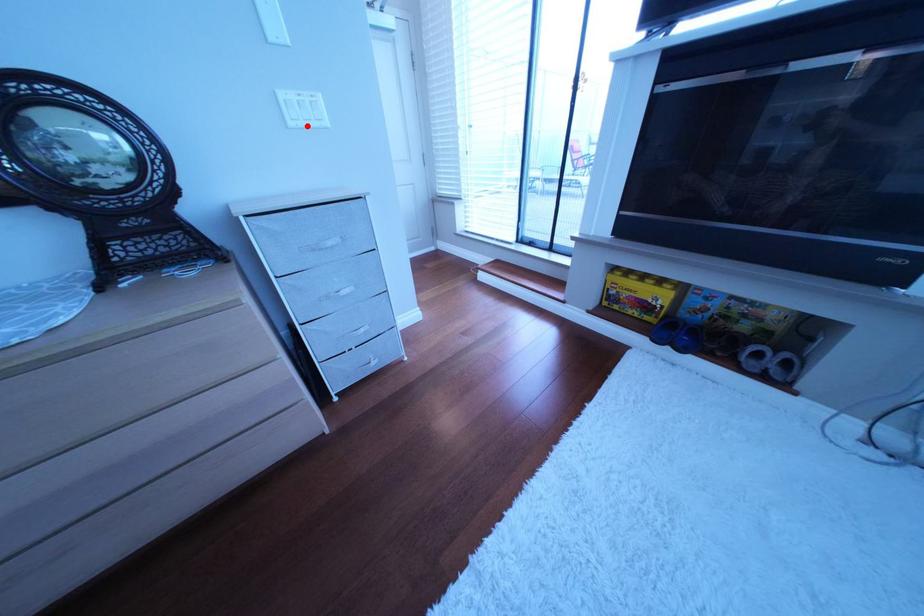
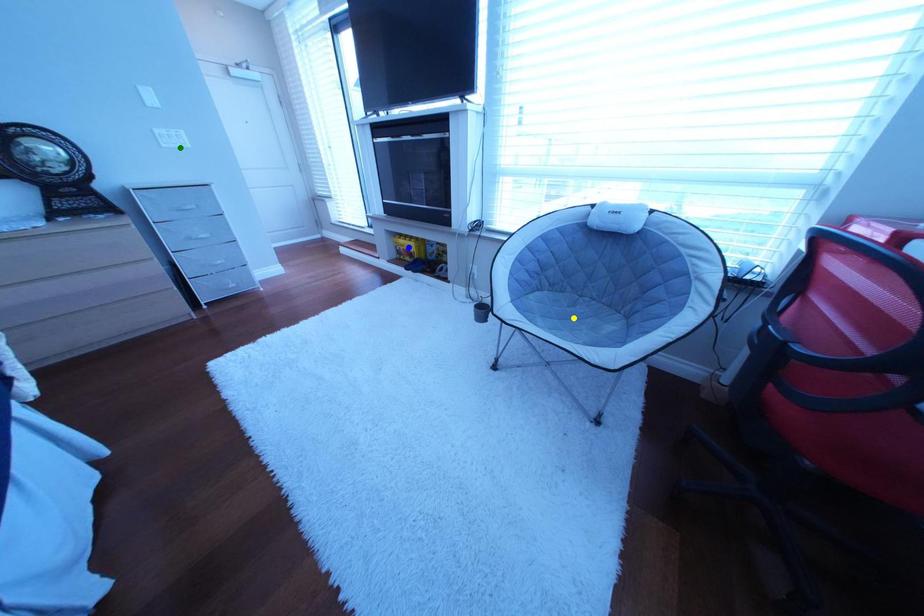
Question: I am providing you with two images of the same scene from different viewpoints. A red point is marked on the first image. You are given multiple points on the second image. Which spot in image 2 lines up with the point in image 1?

Choices:
 (A) green point
 (B) blue point
 (C) yellow point

Answer: (A)